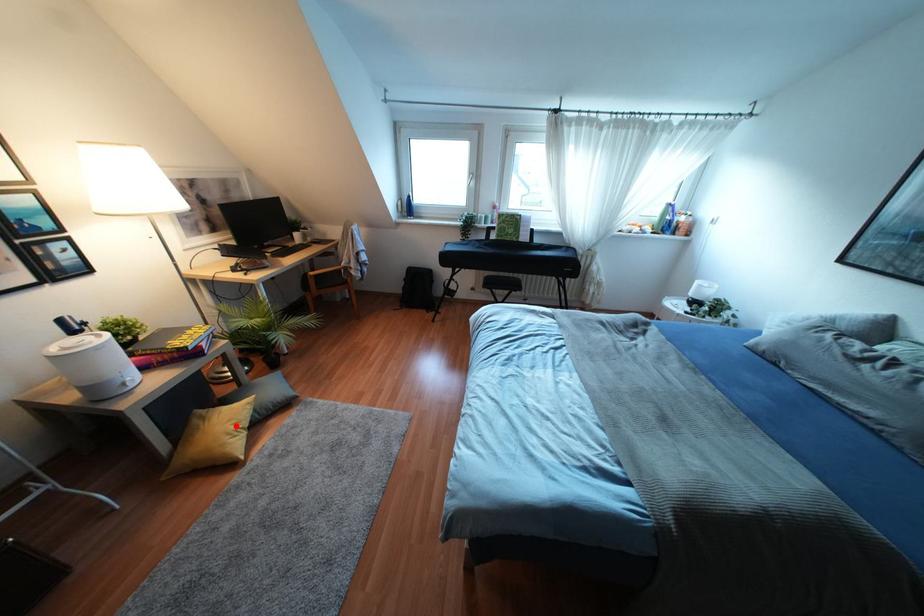
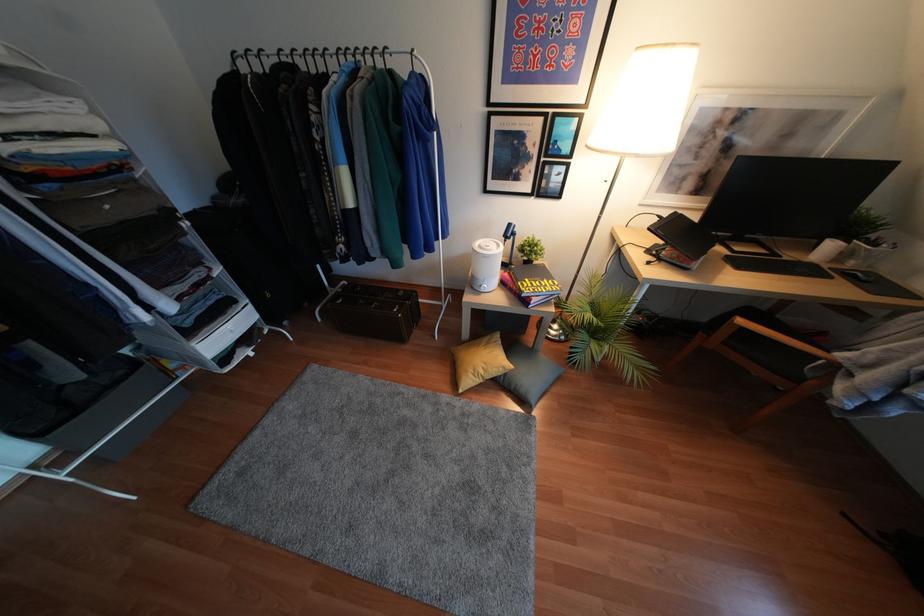
Question: I am providing you with two images of the same scene from different viewpoints. A red point is shown in image1. For the corresponding object point in image2, is it positioned nearer or farther from the camera?

Choices:
 (A) Nearer
 (B) Farther

Answer: (B)